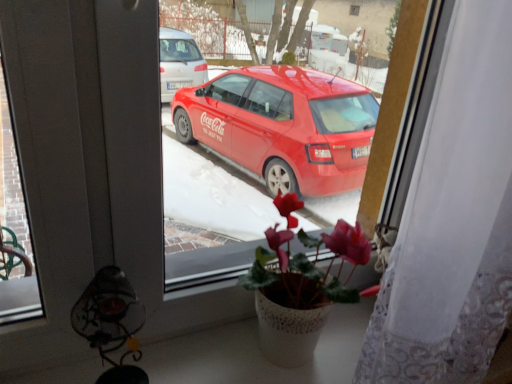
I want to click on pink matte cyclamen at center, so click(300, 285).

Identify the location of white lace curtain at right. Image resolution: width=512 pixels, height=384 pixels. (453, 219).

Locate an element on the screen. This screenshot has width=512, height=384. pink matte cyclamen at center is located at coordinates (300, 285).

From a real-world perspective, is white lace curtain at right positioned under pink matte cyclamen at center based on gravity?

No, from a real-world perspective, white lace curtain at right is not under pink matte cyclamen at center.

The width and height of the screenshot is (512, 384). I want to click on curtain on the right side of pink matte cyclamen at center, so click(453, 219).

Is white lace curtain at right turned away from pink matte cyclamen at center?

Yes, pink matte cyclamen at center is at the back of white lace curtain at right.

Considering the points (456, 365) and (356, 222), which point is behind, point (456, 365) or point (356, 222)?

The point (356, 222) is farther from the camera.

Is metallic wire lamp at lower left completely or partially outside of white lace curtain at right?

metallic wire lamp at lower left is positioned outside white lace curtain at right.

Locate an element on the screen. The image size is (512, 384). curtain to the right of metallic wire lamp at lower left is located at coordinates (453, 219).

Is metallic wire lamp at lower left to the left or to the right of white lace curtain at right in the image?

metallic wire lamp at lower left is to the left of white lace curtain at right.

Is metallic wire lamp at lower left touching white lace curtain at right?

No, metallic wire lamp at lower left is not making contact with white lace curtain at right.

Does metallic wire lamp at lower left contain pink matte cyclamen at center?

Definitely not — pink matte cyclamen at center is not inside metallic wire lamp at lower left.

Between metallic wire lamp at lower left and pink matte cyclamen at center, which one has larger width?

Wider between the two is pink matte cyclamen at center.

From the image's perspective, which object appears higher, metallic wire lamp at lower left or pink matte cyclamen at center?

From the image's view, pink matte cyclamen at center is above.

Who is bigger, white lace curtain at right or metallic wire lamp at lower left?

white lace curtain at right.

Is white lace curtain at right beside metallic wire lamp at lower left?

There is a gap between white lace curtain at right and metallic wire lamp at lower left.

Considering the sizes of objects white lace curtain at right and metallic wire lamp at lower left in the image provided, who is thinner, white lace curtain at right or metallic wire lamp at lower left?

Thinner between the two is metallic wire lamp at lower left.

I want to click on curtain on the right of the metallic wire lamp at lower left, so click(453, 219).

Is pink matte cyclamen at center positioned with its back to metallic wire lamp at lower left?

No, pink matte cyclamen at center's orientation is not away from metallic wire lamp at lower left.

From the image's perspective, which is above, pink matte cyclamen at center or metallic wire lamp at lower left?

pink matte cyclamen at center is shown above in the image.

From a real-world perspective, is pink matte cyclamen at center above or below metallic wire lamp at lower left?

In terms of real-world spatial position, pink matte cyclamen at center is above metallic wire lamp at lower left.

Does pink matte cyclamen at center have a greater width compared to metallic wire lamp at lower left?

Yes, pink matte cyclamen at center is wider than metallic wire lamp at lower left.

Measure the distance between pink matte cyclamen at center and white lace curtain at right.

A distance of 7.72 inches exists between pink matte cyclamen at center and white lace curtain at right.

Considering the positions of objects pink matte cyclamen at center and white lace curtain at right in the image provided, who is in front, pink matte cyclamen at center or white lace curtain at right?

white lace curtain at right.

Considering the positions of point (257, 279) and point (375, 364), is point (257, 279) closer or farther from the camera than point (375, 364)?

Point (257, 279) is farther from the camera than point (375, 364).

From a real-world perspective, which object rests below the other?

From a 3D spatial view, pink matte cyclamen at center is below.

Locate an element on the screen. This screenshot has width=512, height=384. houseplant that appears below the white lace curtain at right (from a real-world perspective) is located at coordinates (300, 285).

The width and height of the screenshot is (512, 384). In the image, there is a metallic wire lamp at lower left. Find the location of `curtain above it (from the image's perspective)`. curtain above it (from the image's perspective) is located at coordinates (453, 219).

When comparing their distances from white lace curtain at right, does metallic wire lamp at lower left or pink matte cyclamen at center seem closer?

pink matte cyclamen at center is closer to white lace curtain at right.

From the image, which object appears to be nearer to pink matte cyclamen at center, metallic wire lamp at lower left or white lace curtain at right?

white lace curtain at right is positioned closer to the anchor pink matte cyclamen at center.

Estimate the real-world distances between objects in this image. Which object is closer to pink matte cyclamen at center, white lace curtain at right or metallic wire lamp at lower left?

Among the two, white lace curtain at right is located nearer to pink matte cyclamen at center.

Estimate the real-world distances between objects in this image. Which object is further from metallic wire lamp at lower left, white lace curtain at right or pink matte cyclamen at center?

white lace curtain at right is positioned further to the anchor metallic wire lamp at lower left.

Estimate the real-world distances between objects in this image. Which object is closer to white lace curtain at right, pink matte cyclamen at center or metallic wire lamp at lower left?

The object closer to white lace curtain at right is pink matte cyclamen at center.

Estimate the real-world distances between objects in this image. Which object is further from metallic wire lamp at lower left, pink matte cyclamen at center or white lace curtain at right?

white lace curtain at right is further to metallic wire lamp at lower left.

Locate an element on the screen. houseplant between metallic wire lamp at lower left and white lace curtain at right is located at coordinates (300, 285).